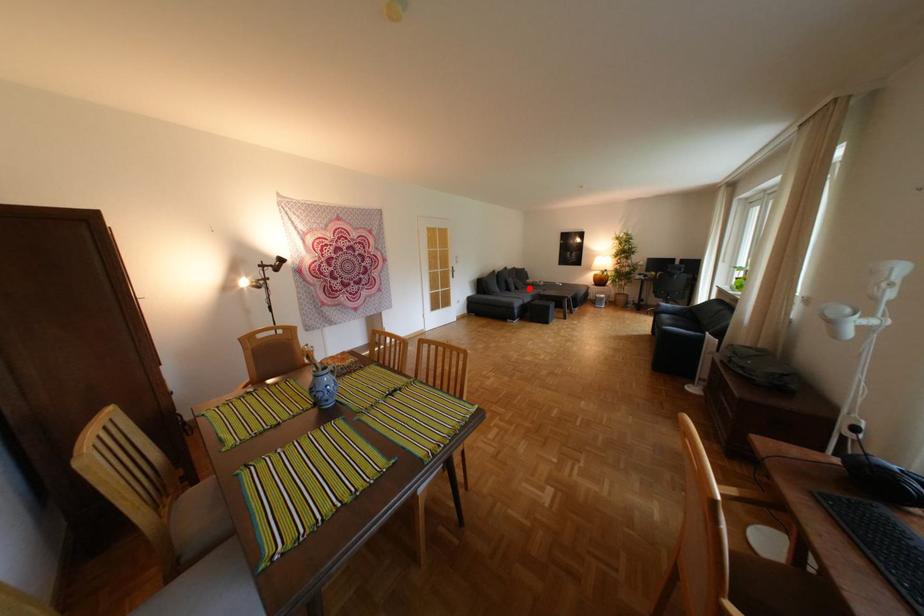
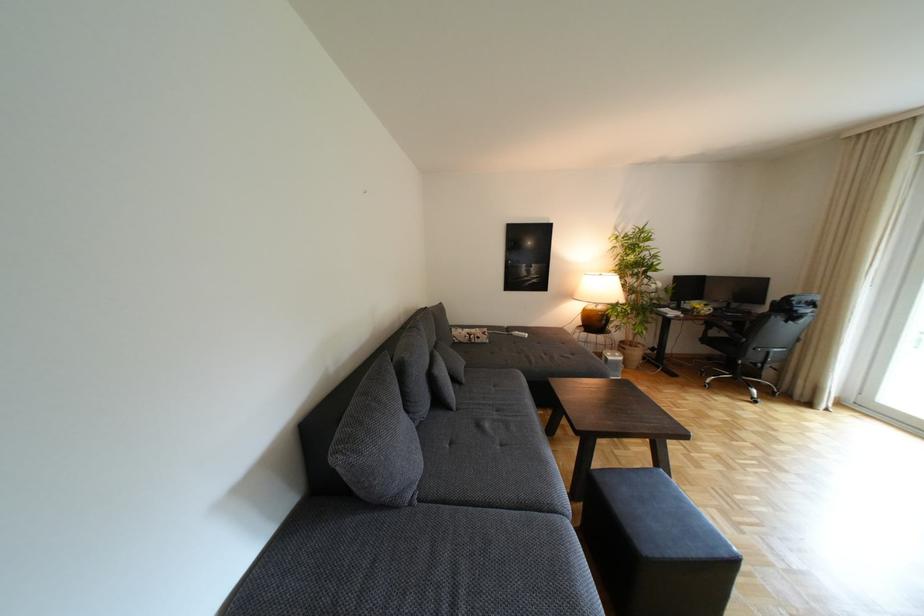
Question: I am providing you with two images of the same scene from different viewpoints. Image1 has a red point marked. In image2, the corresponding 3D location appears at what relative position? Reply with the corresponding letter.

Choices:
 (A) Closer
 (B) Farther

Answer: (B)